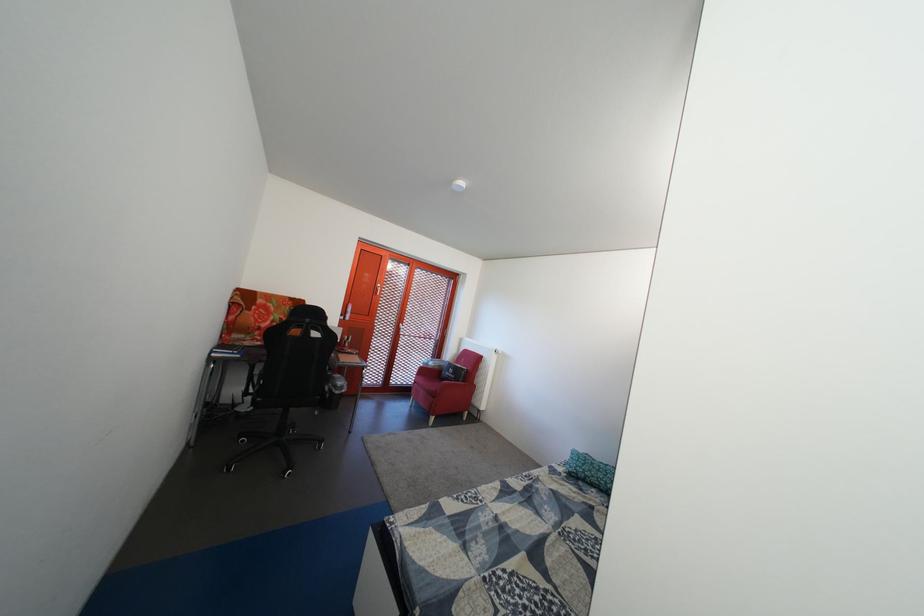
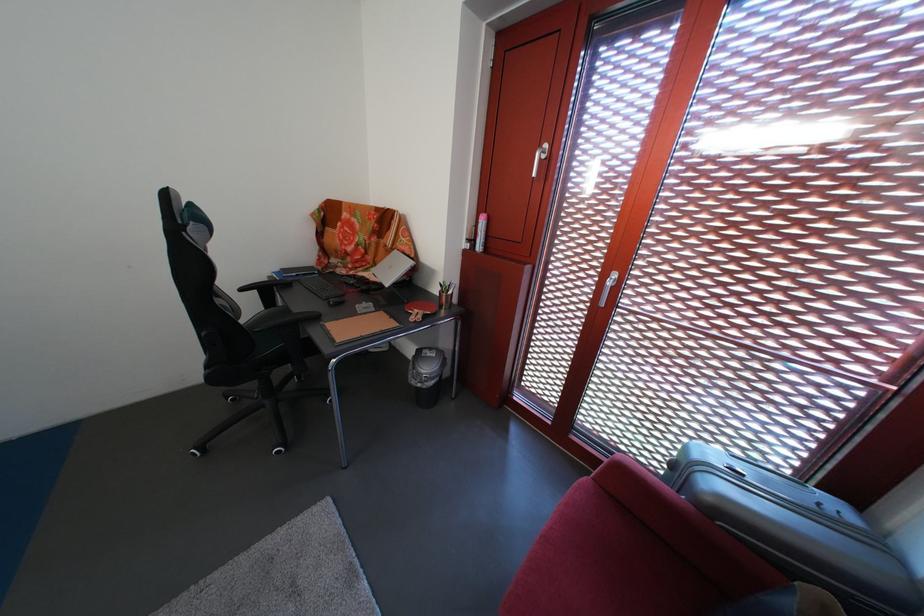
In the second image, find the point that corresponds to point (348, 399) in the first image.

(424, 389)